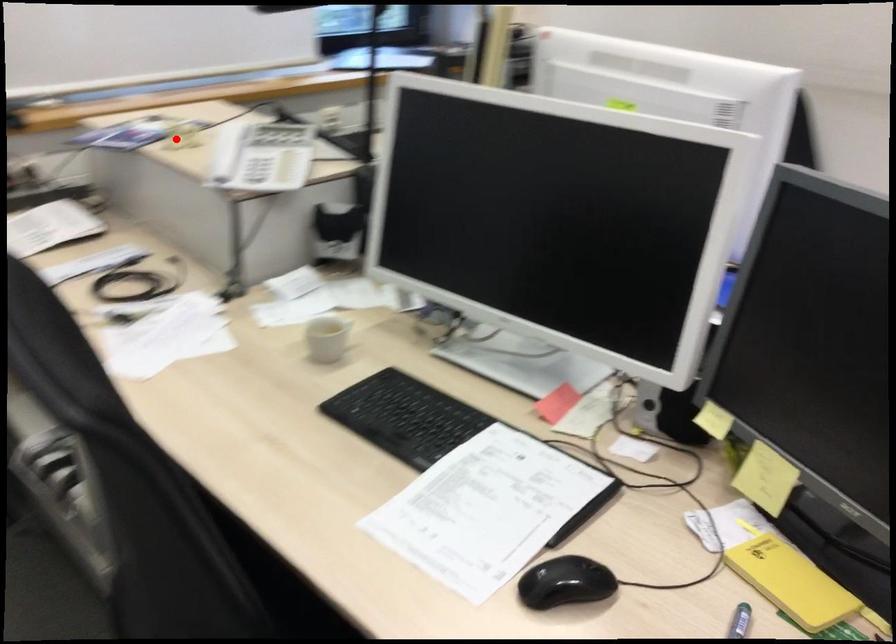
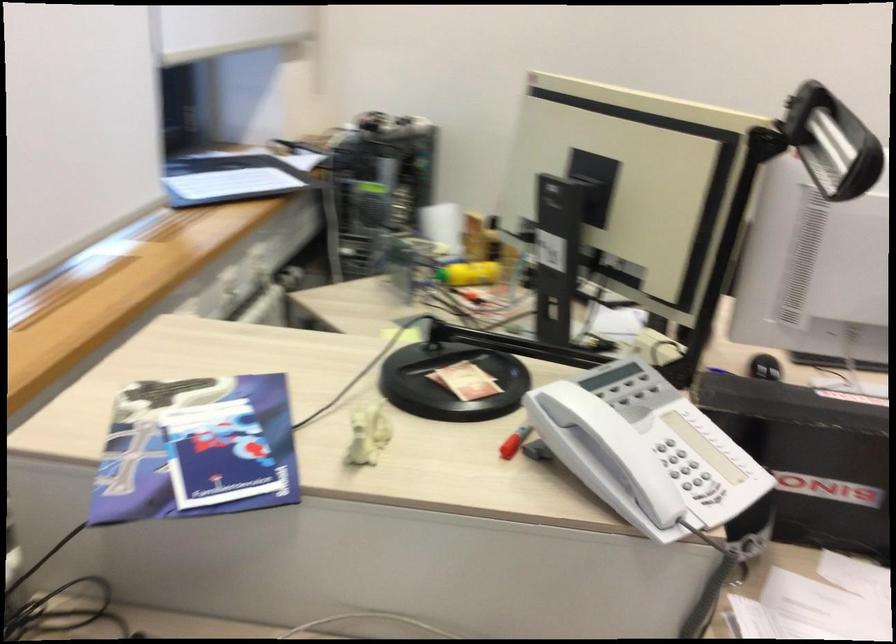
Question: I am providing you with two images of the same scene from different viewpoints. Image1 has a red point marked. In image2, the corresponding 3D location appears at what relative position? Reply with the corresponding letter.

Choices:
 (A) Closer
 (B) Farther

Answer: (A)